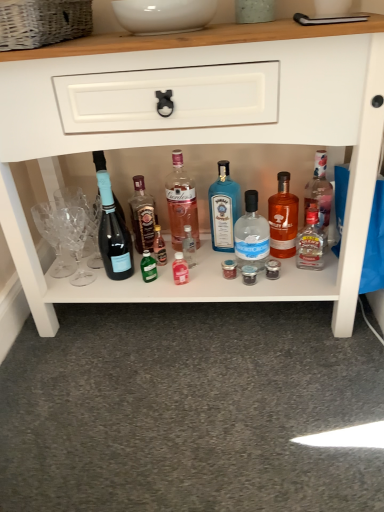
Describe the element at coordinates (224, 209) in the screenshot. Image resolution: width=384 pixels, height=512 pixels. I see `blue glass bottle at center, the fourth bottle positioned from the right` at that location.

The height and width of the screenshot is (512, 384). What do you see at coordinates (319, 192) in the screenshot?
I see `translucent glass bottle at right, which is counted as the seventh bottle, starting from the left` at bounding box center [319, 192].

Measure the distance between pink glass bottle at center, positioned as the third bottle in left-to-right order, and camera.

pink glass bottle at center, positioned as the third bottle in left-to-right order, and camera are 1.24 meters apart from each other.

Describe the element at coordinates (113, 234) in the screenshot. I see `black glass bottle at center, which is counted as the 7th bottle, starting from the right` at that location.

What do you see at coordinates (142, 216) in the screenshot?
I see `matte glass bottle at center, arranged as the sixth bottle when viewed from the right` at bounding box center [142, 216].

Where is `matte glass bottle at center, which appears as the second bottle when viewed from the left`? This screenshot has width=384, height=512. matte glass bottle at center, which appears as the second bottle when viewed from the left is located at coordinates (142, 216).

This screenshot has height=512, width=384. I want to click on blue glass bottle at center, the fourth bottle positioned from the right, so click(x=224, y=209).

Between translucent glass bottle at right, which is counted as the seventh bottle, starting from the left, and woven wicker basket at upper left, which one has less height?

With less height is woven wicker basket at upper left.

Which point is more forward, (325, 161) or (79, 3)?

Positioned in front is point (79, 3).

How many degrees apart are the facing directions of translucent glass bottle at right, which is counted as the seventh bottle, starting from the left, and woven wicker basket at upper left?

10.7 degrees separate the facing orientations of translucent glass bottle at right, which is counted as the seventh bottle, starting from the left, and woven wicker basket at upper left.

Measure the distance between translucent glass bottle at right, which is counted as the seventh bottle, starting from the left, and woven wicker basket at upper left.

They are 27.95 inches apart.

Is translucent amber glass bottle at center-right, marked as the sixth bottle in a left-to-right arrangement, taller than white glossy shelf at center?

No.

Is translucent amber glass bottle at center-right, marked as the 2th bottle in a right-to-left arrangement, wider or thinner than white glossy shelf at center?

translucent amber glass bottle at center-right, marked as the 2th bottle in a right-to-left arrangement, is thinner than white glossy shelf at center.

Is point (281, 222) positioned in front of point (379, 80)?

No, (281, 222) is further to viewer.

From a real-world perspective, does translucent amber glass bottle at center-right, marked as the sixth bottle in a left-to-right arrangement, sit lower than white glossy shelf at center?

Yes, from a real-world perspective, translucent amber glass bottle at center-right, marked as the sixth bottle in a left-to-right arrangement, is below white glossy shelf at center.

This screenshot has height=512, width=384. I want to click on the 2nd bottle above the transparent glass bottle at center, the 3th bottle in the right-to-left sequence (from the image's perspective), so click(283, 219).

Can you confirm if transparent glass bottle at center, the 3th bottle in the right-to-left sequence, is taller than translucent amber glass bottle at center-right, marked as the sixth bottle in a left-to-right arrangement?

No.

Based on the photo, from a real-world perspective, which object stands above the other?

translucent amber glass bottle at center-right, marked as the 2th bottle in a right-to-left arrangement, is physically above.

Is transparent glass bottle at center, arranged as the 5th bottle when viewed from the left, facing away from translucent amber glass bottle at center-right, marked as the 2th bottle in a right-to-left arrangement?

transparent glass bottle at center, arranged as the 5th bottle when viewed from the left, does not have its back to translucent amber glass bottle at center-right, marked as the 2th bottle in a right-to-left arrangement.

Is point (261, 225) positioned in front of point (33, 48)?

No, it is not.

Does transparent glass bottle at center, arranged as the 5th bottle when viewed from the left, come behind woven wicker basket at upper left?

Yes, transparent glass bottle at center, arranged as the 5th bottle when viewed from the left, is behind woven wicker basket at upper left.

Considering the relative sizes of transparent glass bottle at center, the 3th bottle in the right-to-left sequence, and woven wicker basket at upper left in the image provided, is transparent glass bottle at center, the 3th bottle in the right-to-left sequence, wider than woven wicker basket at upper left?

No.

Is transparent glass bottle at center, the 3th bottle in the right-to-left sequence, directly adjacent to translucent glass bottle at right, which is counted as the seventh bottle, starting from the left?

There is a gap between transparent glass bottle at center, the 3th bottle in the right-to-left sequence, and translucent glass bottle at right, which is counted as the seventh bottle, starting from the left.

Which is closer, (235, 247) or (322, 166)?

Point (235, 247).

From a real-world perspective, is transparent glass bottle at center, the 3th bottle in the right-to-left sequence, beneath translucent glass bottle at right, arranged as the 1th bottle when viewed from the right?

Yes, from a real-world perspective, transparent glass bottle at center, the 3th bottle in the right-to-left sequence, is beneath translucent glass bottle at right, arranged as the 1th bottle when viewed from the right.

From the image's perspective, would you say transparent glass bottle at center, arranged as the 5th bottle when viewed from the left, is positioned over translucent glass bottle at right, arranged as the 1th bottle when viewed from the right?

No, from the image's perspective, transparent glass bottle at center, arranged as the 5th bottle when viewed from the left, is not above translucent glass bottle at right, arranged as the 1th bottle when viewed from the right.

Would you say white glossy shelf at center is to the left or to the right of black glass bottle at center, which is counted as the first bottle, starting from the left, in the picture?

Clearly, white glossy shelf at center is on the right of black glass bottle at center, which is counted as the first bottle, starting from the left, in the image.

How many degrees apart are the facing directions of white glossy shelf at center and black glass bottle at center, which is counted as the first bottle, starting from the left?

There is a 12.5-degree angle between the facing directions of white glossy shelf at center and black glass bottle at center, which is counted as the first bottle, starting from the left.

Does white glossy shelf at center lie in front of black glass bottle at center, which is counted as the 7th bottle, starting from the right?

Yes.

Is white glossy shelf at center wider or thinner than black glass bottle at center, which is counted as the first bottle, starting from the left?

white glossy shelf at center is wider than black glass bottle at center, which is counted as the first bottle, starting from the left.

Where is `shelf that is in front of the matte glass bottle at center, which appears as the second bottle when viewed from the left`? shelf that is in front of the matte glass bottle at center, which appears as the second bottle when viewed from the left is located at coordinates (204, 141).

Can you confirm if matte glass bottle at center, arranged as the sixth bottle when viewed from the right, is positioned to the right of white glossy shelf at center?

No.

From the image's perspective, which is above, matte glass bottle at center, arranged as the sixth bottle when viewed from the right, or white glossy shelf at center?

white glossy shelf at center.

Can we say matte glass bottle at center, arranged as the sixth bottle when viewed from the right, lies outside white glossy shelf at center?

No, matte glass bottle at center, arranged as the sixth bottle when viewed from the right, is not outside of white glossy shelf at center.

The image size is (384, 512). I want to click on bottle that is the 3rd object located below the woven wicker basket at upper left (from the image's perspective), so tap(319, 192).

At what (x,y) coordinates should I click in order to perform the action: click on shelf that is on the left side of translucent amber glass bottle at center-right, marked as the 2th bottle in a right-to-left arrangement. Please return your answer as a coordinate pair (x, y). The width and height of the screenshot is (384, 512). Looking at the image, I should click on (204, 141).

From the image, which object appears to be farther from matte glass bottle at center, arranged as the sixth bottle when viewed from the right, blue glass bottle at center, marked as the fourth bottle in a left-to-right arrangement, or pink glass bottle at center, placed as the fifth bottle when sorted from right to left?

blue glass bottle at center, marked as the fourth bottle in a left-to-right arrangement, lies further to matte glass bottle at center, arranged as the sixth bottle when viewed from the right, than the other object.

From the image, which object appears to be nearer to woven wicker basket at upper left, white glossy shelf at center or pink glass bottle at center, positioned as the third bottle in left-to-right order?

The object closer to woven wicker basket at upper left is white glossy shelf at center.

Based on their spatial positions, is blue glass bottle at center, marked as the fourth bottle in a left-to-right arrangement, or woven wicker basket at upper left further from pink glass bottle at center, positioned as the third bottle in left-to-right order?

woven wicker basket at upper left is positioned further to the anchor pink glass bottle at center, positioned as the third bottle in left-to-right order.

Estimate the real-world distances between objects in this image. Which object is further from translucent glass bottle at right, which is counted as the seventh bottle, starting from the left, pink glass bottle at center, positioned as the third bottle in left-to-right order, or transparent glass bottle at center, the 3th bottle in the right-to-left sequence?

pink glass bottle at center, positioned as the third bottle in left-to-right order.

Looking at the image, which one is located closer to black glass bottle at center, which is counted as the 7th bottle, starting from the right, translucent glass bottle at right, which is counted as the seventh bottle, starting from the left, or transparent glass bottle at center, the 3th bottle in the right-to-left sequence?

The object closer to black glass bottle at center, which is counted as the 7th bottle, starting from the right, is transparent glass bottle at center, the 3th bottle in the right-to-left sequence.

From the image, which object appears to be farther from woven wicker basket at upper left, black glass bottle at center, which is counted as the 7th bottle, starting from the right, or transparent glass bottle at center, the 3th bottle in the right-to-left sequence?

Based on the image, transparent glass bottle at center, the 3th bottle in the right-to-left sequence, appears to be further to woven wicker basket at upper left.

From the image, which object appears to be farther from pink glass bottle at center, positioned as the third bottle in left-to-right order, white glossy shelf at center or woven wicker basket at upper left?

woven wicker basket at upper left lies further to pink glass bottle at center, positioned as the third bottle in left-to-right order, than the other object.

Based on their spatial positions, is transparent glass bottle at center, the 3th bottle in the right-to-left sequence, or black glass bottle at center, which is counted as the first bottle, starting from the left, further from blue glass bottle at center, marked as the fourth bottle in a left-to-right arrangement?

Based on the image, black glass bottle at center, which is counted as the first bottle, starting from the left, appears to be further to blue glass bottle at center, marked as the fourth bottle in a left-to-right arrangement.

The height and width of the screenshot is (512, 384). Find the location of `shelf situated between matte glass bottle at center, which appears as the second bottle when viewed from the left, and translucent glass bottle at right, arranged as the 1th bottle when viewed from the right, from left to right`. shelf situated between matte glass bottle at center, which appears as the second bottle when viewed from the left, and translucent glass bottle at right, arranged as the 1th bottle when viewed from the right, from left to right is located at coordinates (204, 141).

Locate an element on the screen. The width and height of the screenshot is (384, 512). shelf situated between black glass bottle at center, which is counted as the first bottle, starting from the left, and translucent amber glass bottle at center-right, marked as the sixth bottle in a left-to-right arrangement, from left to right is located at coordinates tap(204, 141).

I want to click on shelf located between black glass bottle at center, which is counted as the 7th bottle, starting from the right, and translucent glass bottle at right, which is counted as the seventh bottle, starting from the left, in the left-right direction, so click(x=204, y=141).

The width and height of the screenshot is (384, 512). Find the location of `basket between white glossy shelf at center and pink glass bottle at center, placed as the fifth bottle when sorted from right to left, along the z-axis`. basket between white glossy shelf at center and pink glass bottle at center, placed as the fifth bottle when sorted from right to left, along the z-axis is located at coordinates (42, 22).